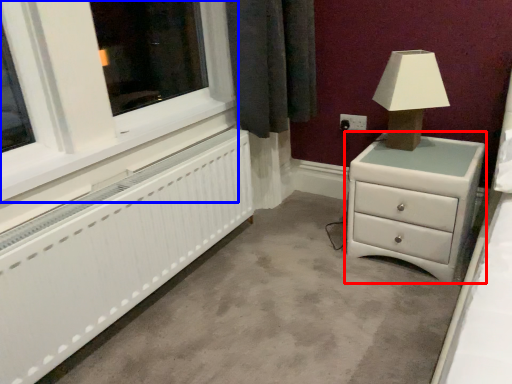
Question: Among these objects, which one is nearest to the camera, chest of drawers (highlighted by a red box) or window frame (highlighted by a blue box)?

Choices:
 (A) chest of drawers
 (B) window frame

Answer: (B)